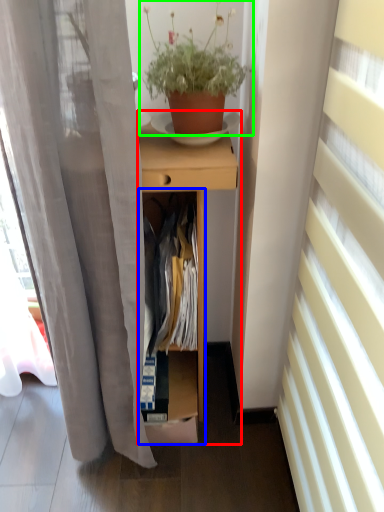
Question: Considering the real-world distances, which object is farthest from desk (highlighted by a red box)? cabinet (highlighted by a blue box) or houseplant (highlighted by a green box)?

Choices:
 (A) cabinet
 (B) houseplant

Answer: (B)